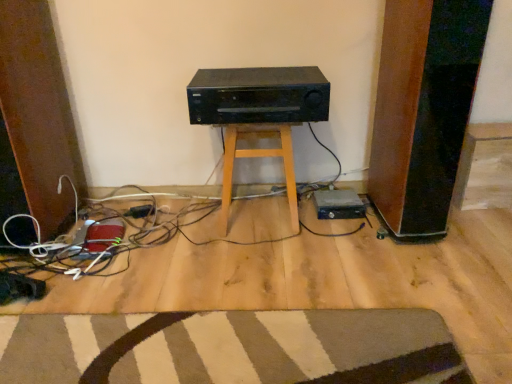
Locate an element on the screen. This screenshot has width=512, height=384. free space in front of black plastic plug at lower center is located at coordinates (126, 234).